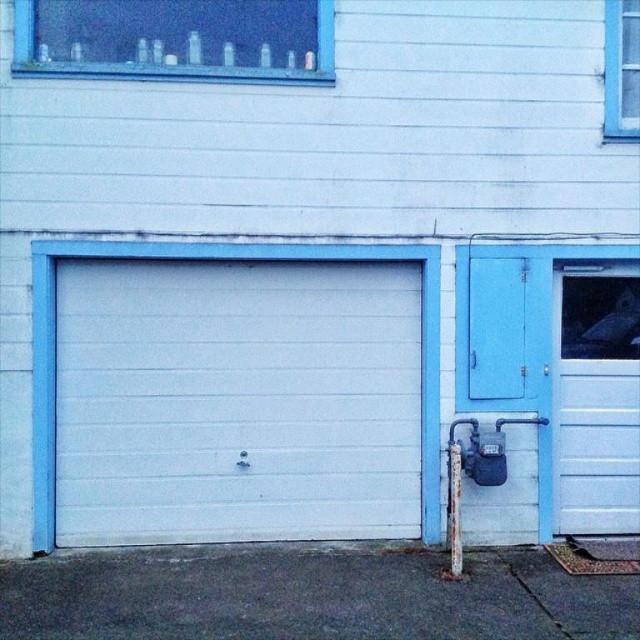
From the picture: You are standing in front of the building and notice a specific point marked at coordinates (595,397). Based on the scene description, can you identify which object this point is located on?

The point at coordinates (595,397) is located on the white matte door at right.

You are standing in front of the building and want to locate the point at coordinates (x=595, y=397). Based on the scene description, where would this point be located?

The point at coordinates (x=595, y=397) is located on the white matte door at the right side of the building.